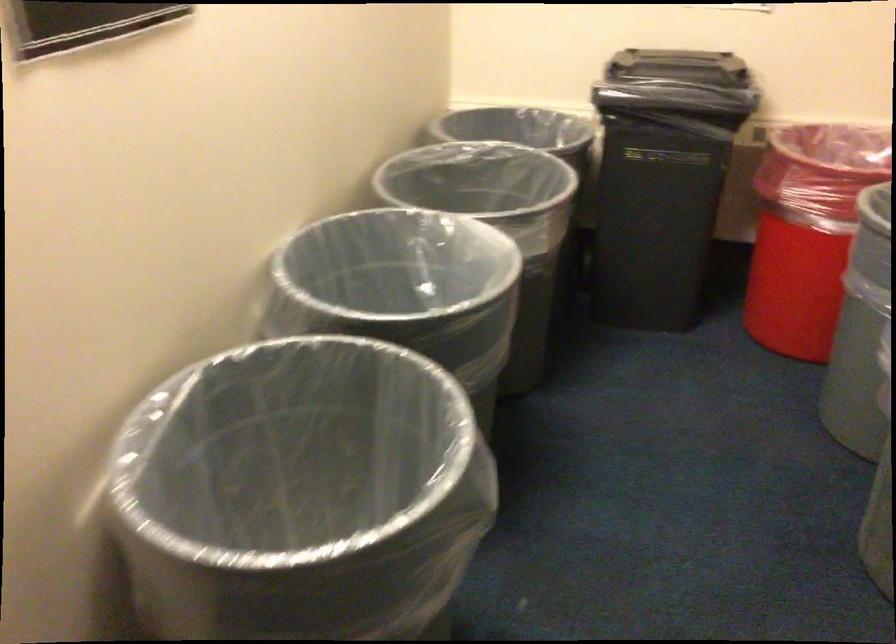
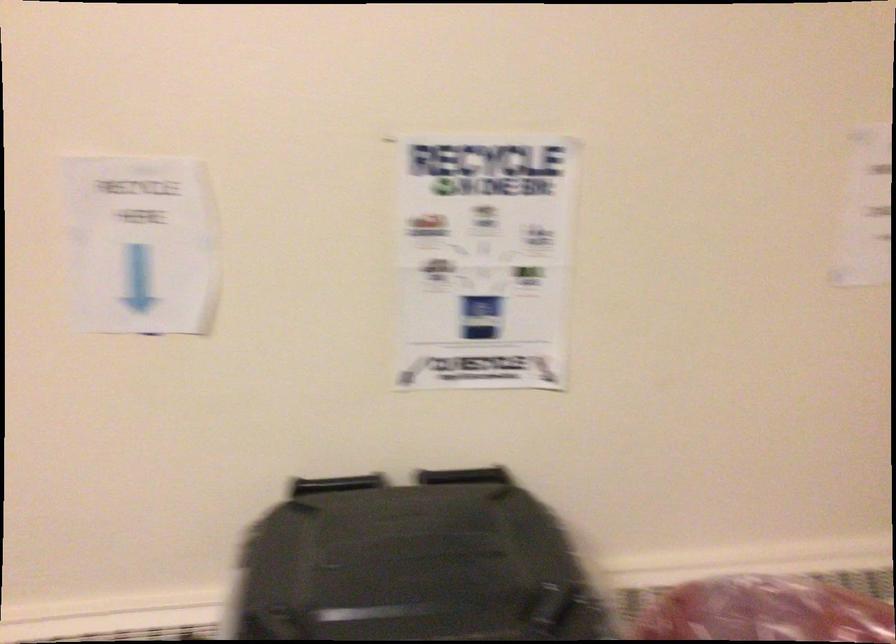
Question: What movement of the cameraman would produce the second image?

Choices:
 (A) Left
 (B) Right
 (C) Forward
 (D) Backward

Answer: (C)